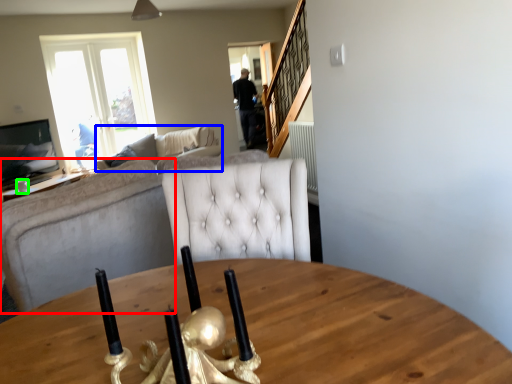
Question: Which object is positioned closest to studio couch (highlighted by a red box)? Select from studio couch (highlighted by a blue box) and coffee cup (highlighted by a green box).

Choices:
 (A) studio couch
 (B) coffee cup

Answer: (A)